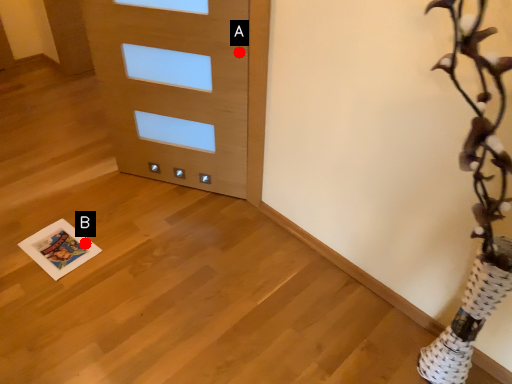
Question: Two points are circled on the image, labeled by A and B beside each circle. Which point is further to the camera?

Choices:
 (A) A is further
 (B) B is further

Answer: (B)